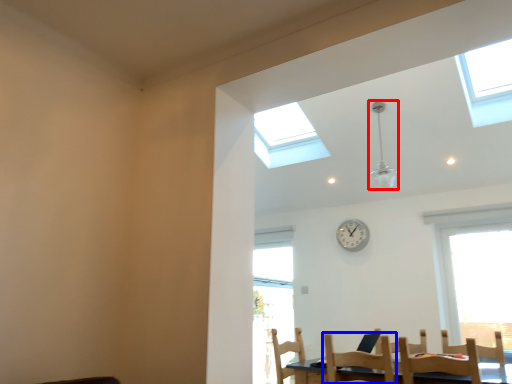
Question: Which object is closer to the camera taking this photo, light fixture (highlighted by a red box) or chair (highlighted by a blue box)?

Choices:
 (A) light fixture
 (B) chair

Answer: (B)